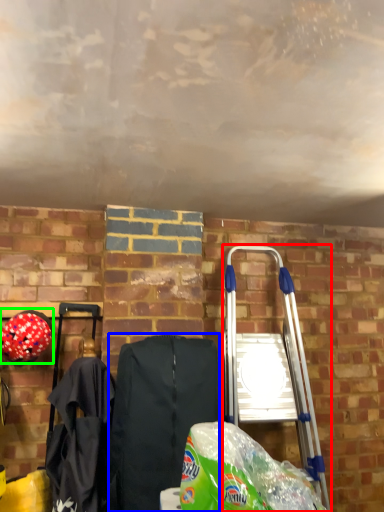
Question: Based on their relative distances, which object is farther from ladder (highlighted by a red box)? Choose from folding chair (highlighted by a blue box) and helmet (highlighted by a green box).

Choices:
 (A) folding chair
 (B) helmet

Answer: (B)